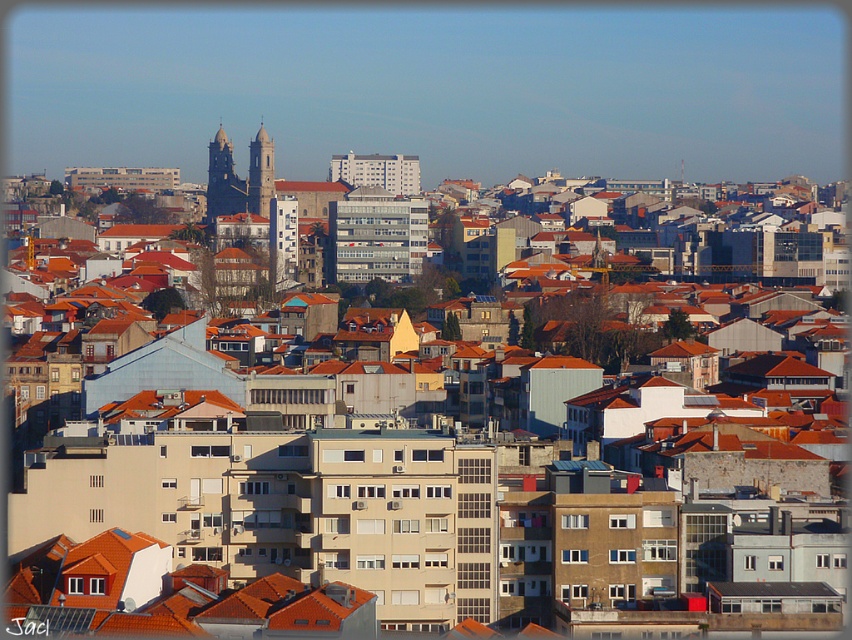
Based on the photo, is dark gray stone tower at upper center behind smooth stone tower at center?

Yes, it is behind smooth stone tower at center.

Measure the distance between dark gray stone tower at upper center and smooth stone tower at center.

They are 4.96 meters apart.

Is point (223, 145) closer to camera compared to point (246, 189)?

No, it is behind (246, 189).

Locate an element on the screen. dark gray stone tower at upper center is located at coordinates (223, 180).